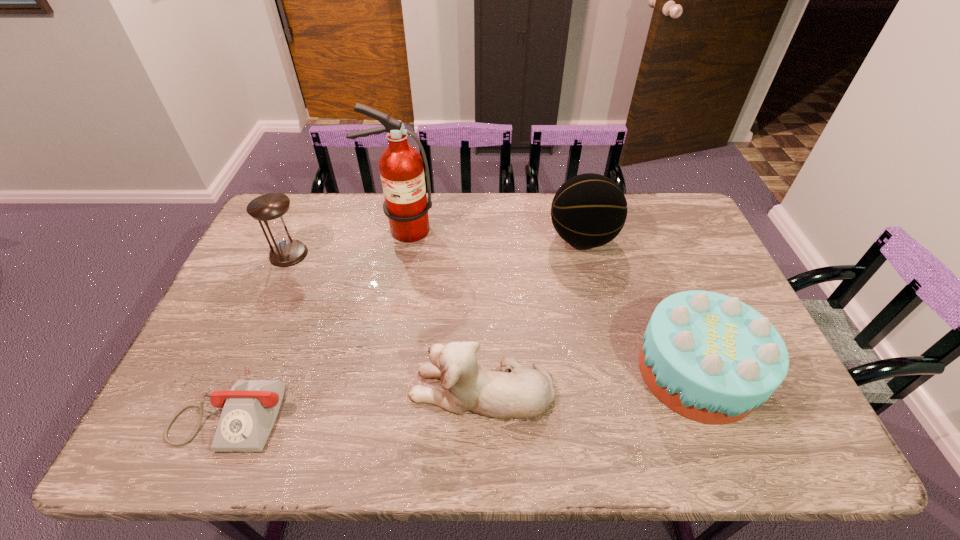
Locate an element on the screen. vacant position in the image that satisfies the following two spatial constraints: 1. on the nozzle and handle of the cake; 2. on the right side of the fire extinguisher is located at coordinates (374, 372).